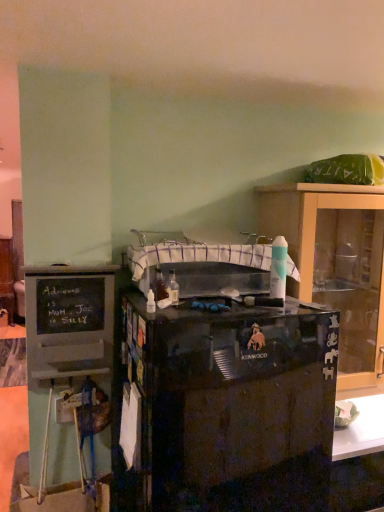
Question: Does matte black kenwood mixer at right, the first cabinetry from the right, have a smaller size compared to black chalkboard cabinet at left, the second cabinetry from the right?

Choices:
 (A) yes
 (B) no

Answer: (B)

Question: From the image's perspective, is matte black kenwood mixer at right, the first cabinetry from the right, on black chalkboard cabinet at left, the second cabinetry from the right?

Choices:
 (A) no
 (B) yes

Answer: (B)

Question: Is matte black kenwood mixer at right, the first cabinetry from the right, positioned behind black chalkboard cabinet at left, marked as the 2th cabinetry in a back-to-front arrangement?

Choices:
 (A) no
 (B) yes

Answer: (B)

Question: Is matte black kenwood mixer at right, the first cabinetry from the right, to the right of black chalkboard cabinet at left, marked as the 2th cabinetry in a back-to-front arrangement, from the viewer's perspective?

Choices:
 (A) yes
 (B) no

Answer: (A)

Question: Is matte black kenwood mixer at right, which is the 1th cabinetry from back to front, with black chalkboard cabinet at left, which is the 1th cabinetry from front to back?

Choices:
 (A) no
 (B) yes

Answer: (A)

Question: Is matte black kenwood mixer at right, which appears as the second cabinetry when viewed from the front, in front of black chalkboard cabinet at left, the second cabinetry from the right?

Choices:
 (A) yes
 (B) no

Answer: (B)

Question: Considering the relative positions of black chalkboard cabinet at left, which is the first cabinetry in left-to-right order, and matte black kenwood mixer at right, the first cabinetry from the right, in the image provided, is black chalkboard cabinet at left, which is the first cabinetry in left-to-right order, to the right of matte black kenwood mixer at right, the first cabinetry from the right, from the viewer's perspective?

Choices:
 (A) yes
 (B) no

Answer: (B)

Question: Considering the relative sizes of black chalkboard cabinet at left, which is the 1th cabinetry from front to back, and matte black kenwood mixer at right, which appears as the second cabinetry when viewed from the front, in the image provided, is black chalkboard cabinet at left, which is the 1th cabinetry from front to back, thinner than matte black kenwood mixer at right, which appears as the second cabinetry when viewed from the front,?

Choices:
 (A) yes
 (B) no

Answer: (A)

Question: Can you confirm if black chalkboard cabinet at left, the second cabinetry from the right, is wider than matte black kenwood mixer at right, the 2th cabinetry from the left?

Choices:
 (A) no
 (B) yes

Answer: (A)

Question: Does black chalkboard cabinet at left, which is the 1th cabinetry from front to back, come behind matte black kenwood mixer at right, the first cabinetry from the right?

Choices:
 (A) yes
 (B) no

Answer: (B)

Question: Considering the relative sizes of black chalkboard cabinet at left, the second cabinetry from the right, and matte black kenwood mixer at right, the 2th cabinetry from the left, in the image provided, is black chalkboard cabinet at left, the second cabinetry from the right, smaller than matte black kenwood mixer at right, the 2th cabinetry from the left,?

Choices:
 (A) yes
 (B) no

Answer: (A)

Question: Is black chalkboard cabinet at left, which is the 1th cabinetry from front to back, completely or partially outside of matte black kenwood mixer at right, the first cabinetry from the right?

Choices:
 (A) yes
 (B) no

Answer: (A)

Question: Is black chalkboard cabinet at left, the second cabinetry from the right, with white fabric sink at center?

Choices:
 (A) no
 (B) yes

Answer: (A)